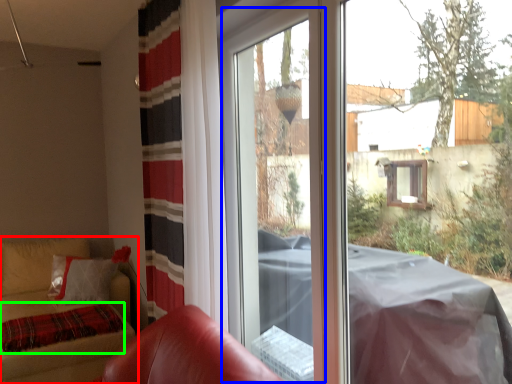
Question: Estimate the real-world distances between objects in this image. Which object is closer to furniture (highlighted by a red box), screen door (highlighted by a blue box) or blanket (highlighted by a green box)?

Choices:
 (A) screen door
 (B) blanket

Answer: (B)